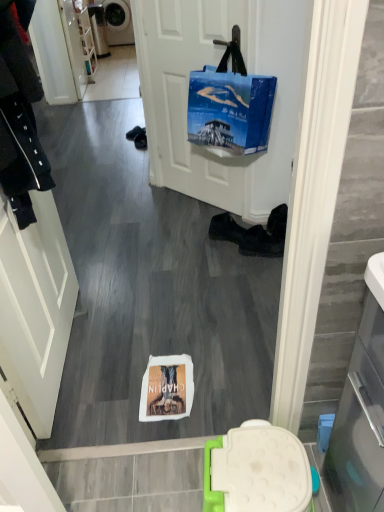
The height and width of the screenshot is (512, 384). I want to click on free space in front of white paper bag at center, so click(x=153, y=424).